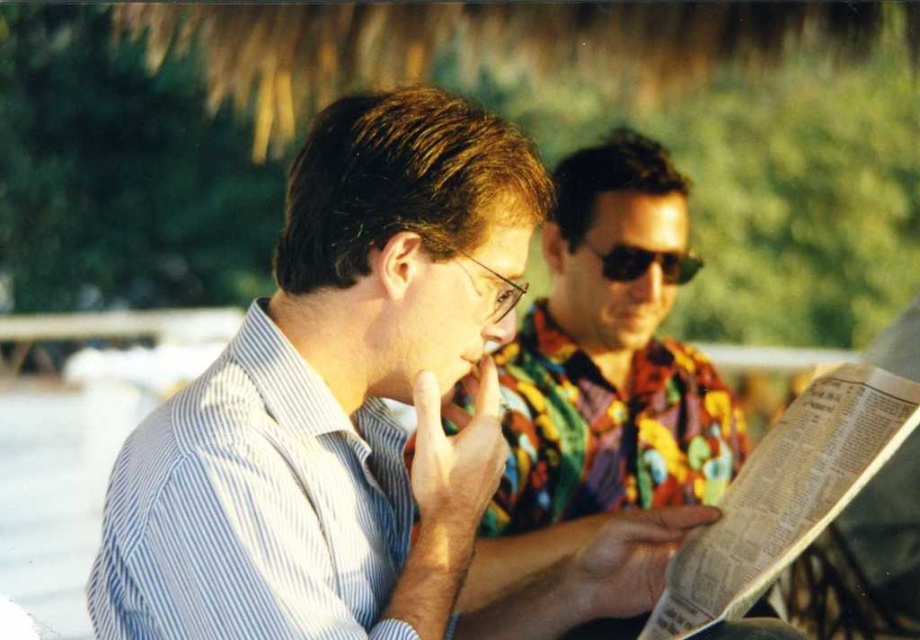
Question: Which of these objects is positioned closest to the white striped shirt at left?

Choices:
 (A) light blue striped shirt at center
 (B) shiny black sunglasses at center
 (C) multicolored floral shirt at center

Answer: (A)

Question: Which object is the closest to the shiny black sunglasses at center?

Choices:
 (A) light blue striped shirt at center
 (B) white striped shirt at left
 (C) multicolored floral shirt at center

Answer: (C)

Question: Where is light blue striped shirt at center located in relation to multicolored floral shirt at center in the image?

Choices:
 (A) right
 (B) left

Answer: (B)

Question: Does light blue striped shirt at center have a lesser width compared to shiny black sunglasses at center?

Choices:
 (A) yes
 (B) no

Answer: (B)

Question: Can you confirm if white striped shirt at left is bigger than shiny black sunglasses at center?

Choices:
 (A) yes
 (B) no

Answer: (A)

Question: Among these points, which one is nearest to the camera?

Choices:
 (A) coord(570,218)
 (B) coord(361,611)
 (C) coord(368,376)

Answer: (B)